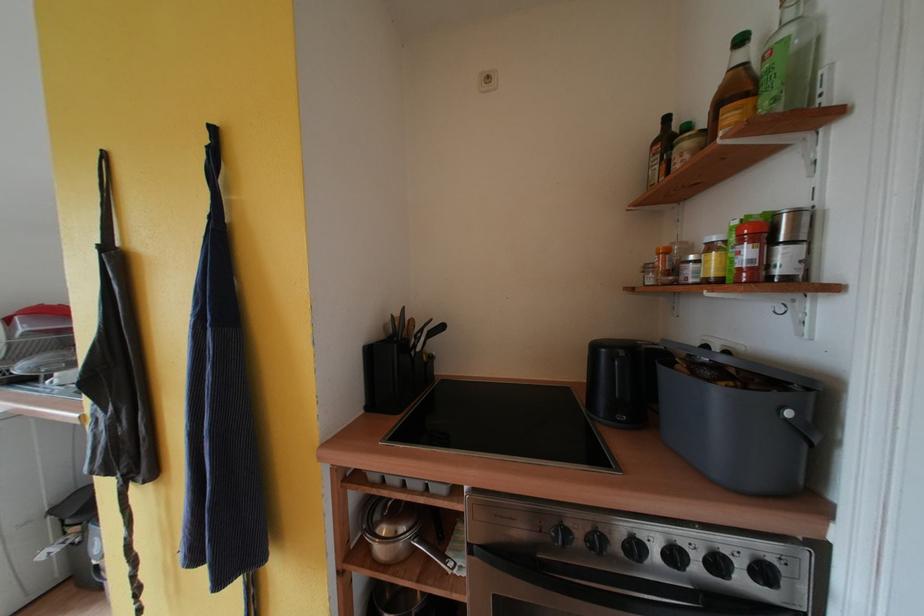
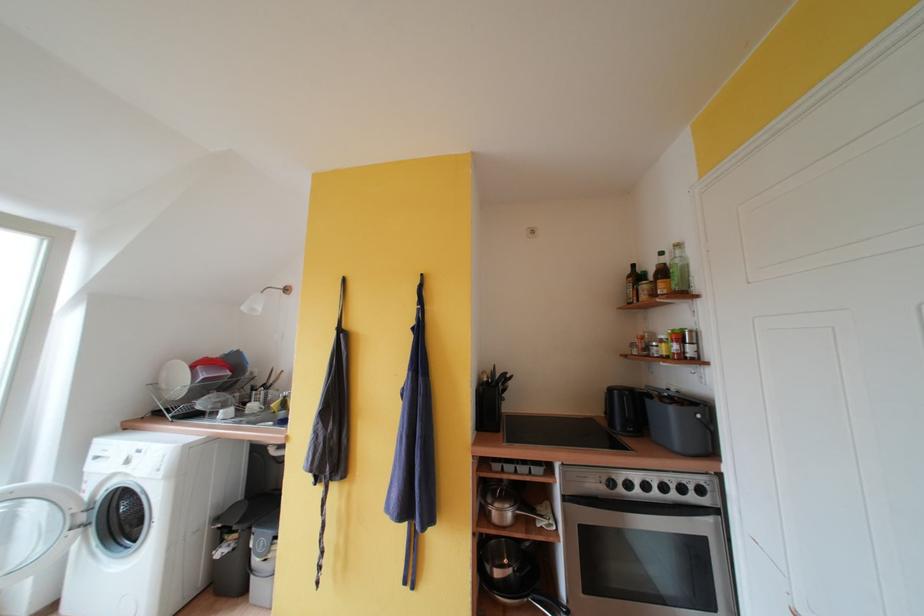
Where in the second image is the point corresponding to pixel 755 55 from the first image?

(671, 262)